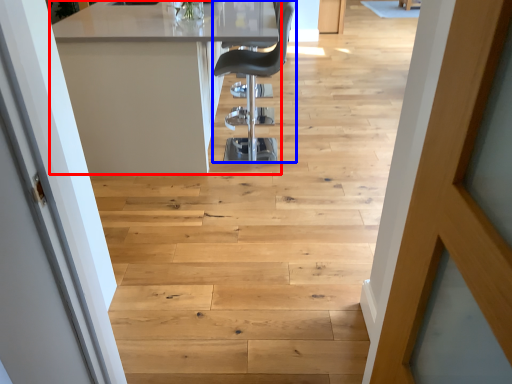
Question: Which of the following is the closest to the observer, table (highlighted by a red box) or chair (highlighted by a blue box)?

Choices:
 (A) table
 (B) chair

Answer: (A)